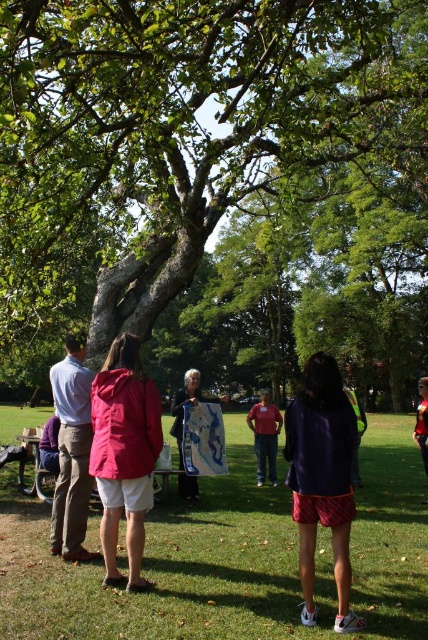
You are organizing a picnic under the large tree and need to place a 3 feet long picnic blanket between the matte pink jacket at center and the light blue shirt at left. Can the blanket fit between them without overlapping either of them?

The distance between the matte pink jacket at center and the light blue shirt at left is 3.54 feet, which is longer than the 3 feet length of the picnic blanket. Therefore, the blanket can fit between them with 0.54 feet of space remaining.

You are standing at the edge of the gathering and want to take a photo of both the green rough bark tree at center and the matte pink jacket at center. Which object should you focus on first to ensure both are in sharp focus?

You should focus on the green rough bark tree at center first because it is closer to the viewer than the matte pink jacket at center, so focusing on the closer object will help both be in focus.

You are attending an outdoor event under a large tree and notice a matte pink shirt at center and a wooden park bench at lower left. Which object is positioned farther away from the front of the image?

The wooden park bench at lower left is behind the matte pink shirt at center, meaning it is farther away from the front of the image.